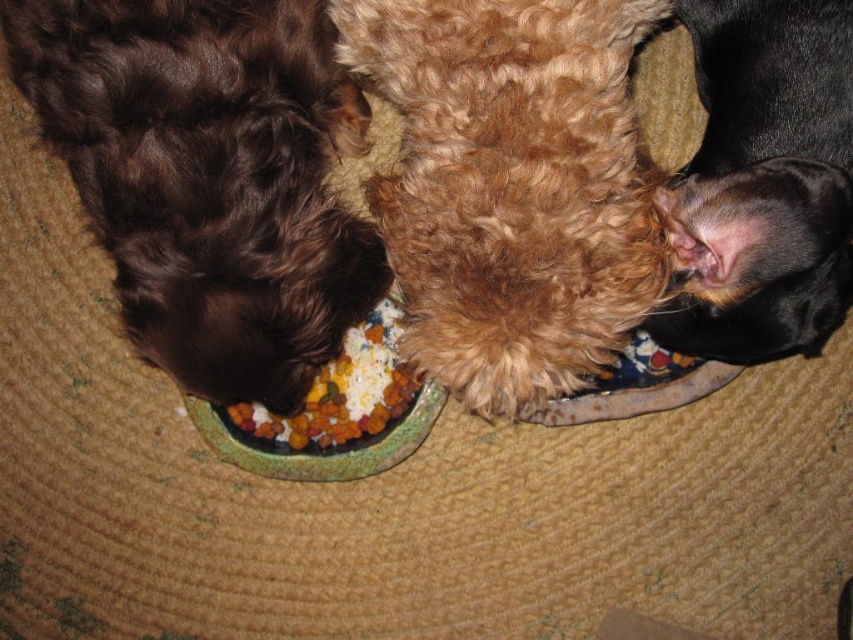
Can you confirm if shiny brown fur at left is bigger than multicolored kibble at center?

Correct, shiny brown fur at left is larger in size than multicolored kibble at center.

Is the position of shiny brown fur at left less distant than that of multicolored kibble at center?

That is True.

Identify the location of shiny brown fur at left. (209, 177).

Can you confirm if black fur at upper right is positioned above multicolored kibble at center?

Correct, black fur at upper right is located above multicolored kibble at center.

Who is more forward, (724,22) or (245,420)?

Point (724,22)

This screenshot has width=853, height=640. I want to click on black fur at upper right, so point(764,182).

Who is taller, shiny brown fur at left or black fur at upper right?

Standing taller between the two is shiny brown fur at left.

From the picture: Who is more distant from viewer, (291,324) or (769,288)?

The point (291,324) is behind.

Does point (1, 16) come farther from viewer compared to point (711, 81)?

No, it is in front of (711, 81).

This screenshot has height=640, width=853. Identify the location of shiny brown fur at left. (209, 177).